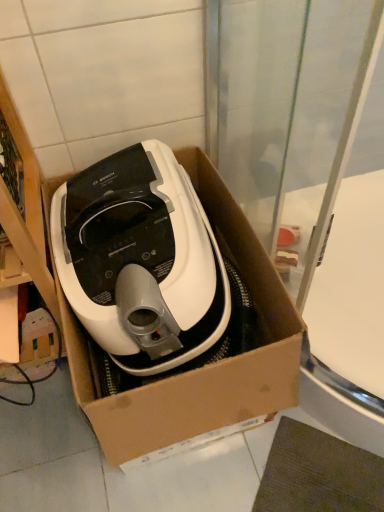
Describe the element at coordinates (140, 260) in the screenshot. I see `white matte vacuum cleaner at center` at that location.

Identify the location of white matte vacuum cleaner at center. (140, 260).

What are the coordinates of `white matte vacuum cleaner at center` in the screenshot? It's located at (140, 260).